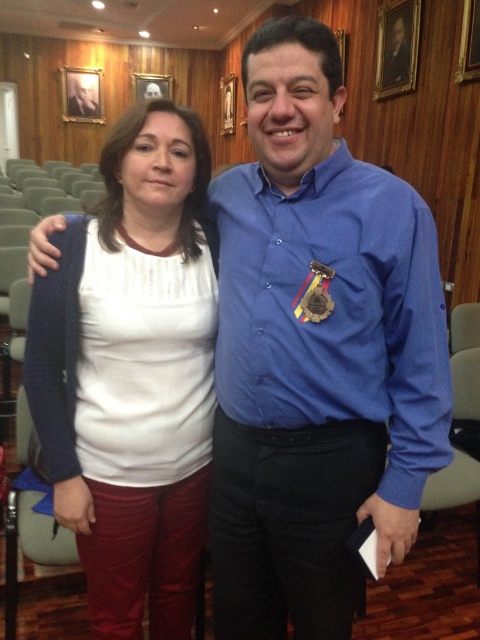
Question: Can you confirm if white matte shirt at center is bigger than blue button-up shirt at center?

Choices:
 (A) no
 (B) yes

Answer: (B)

Question: Is white matte shirt at center thinner than blue button-up shirt at center?

Choices:
 (A) yes
 (B) no

Answer: (A)

Question: Which object appears farthest from the camera in this image?

Choices:
 (A) blue button-up shirt at center
 (B) white matte shirt at center

Answer: (B)

Question: Is white matte shirt at center positioned in front of blue button-up shirt at center?

Choices:
 (A) yes
 (B) no

Answer: (B)